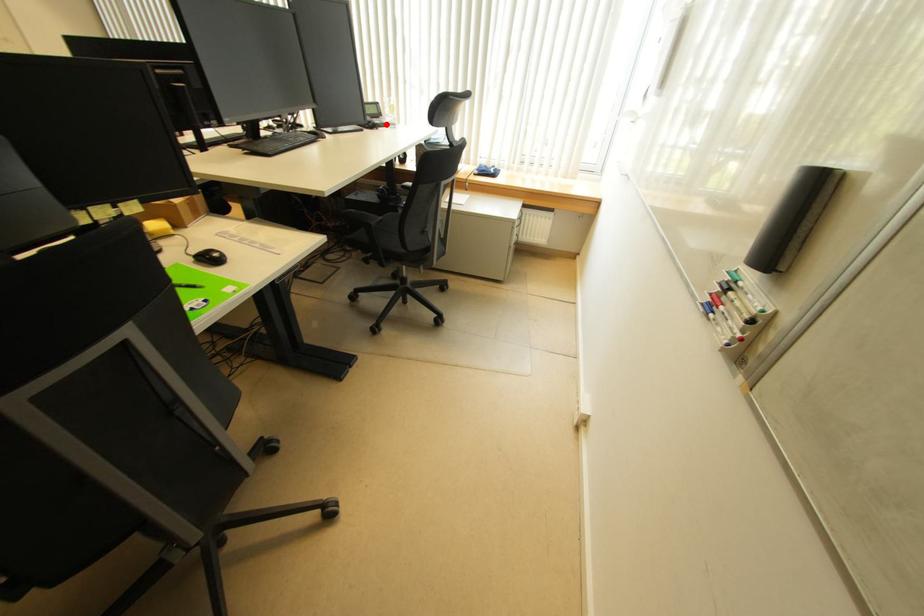
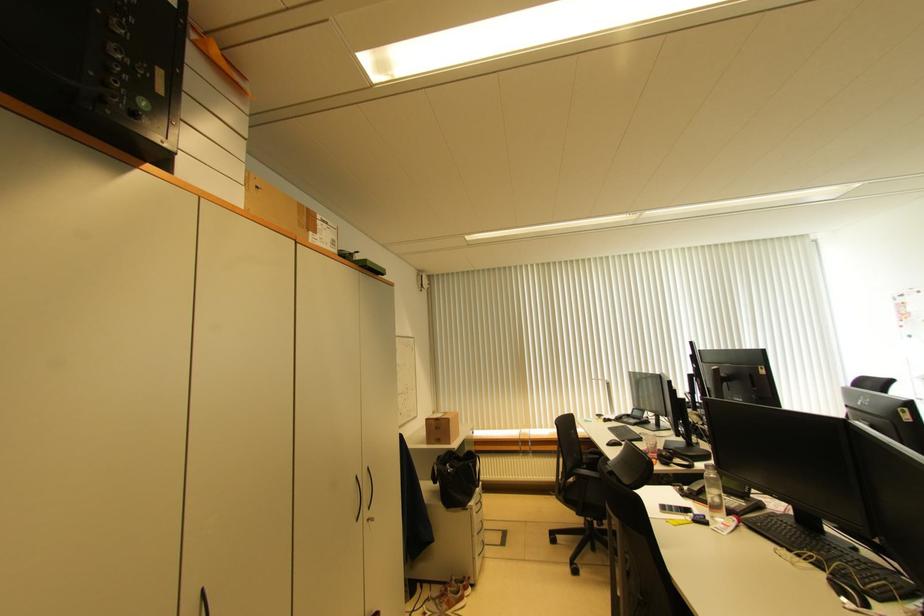
Question: I am providing you with two images of the same scene from different viewpoints. A red point is marked on the first image. At the location where the point appears in image 1, is it still visible in image 2?

Choices:
 (A) Yes
 (B) No

Answer: (B)